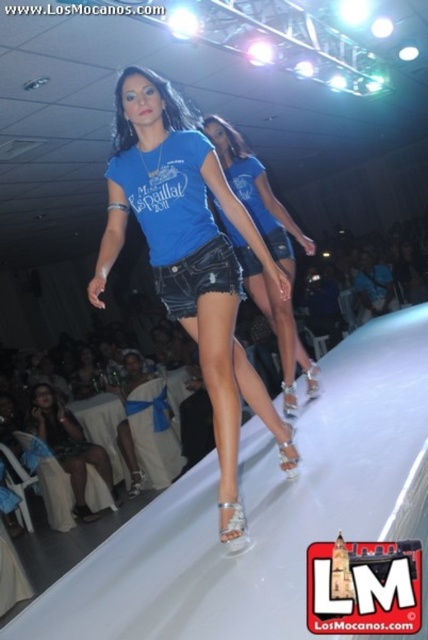
Question: Is blue denim shorts at center above denim shorts at center?

Choices:
 (A) no
 (B) yes

Answer: (B)

Question: Does matte blue denim shorts at center have a lesser width compared to denim shorts at center?

Choices:
 (A) yes
 (B) no

Answer: (B)

Question: Which object is closer to the camera taking this photo?

Choices:
 (A) matte black dress at lower left
 (B) denim shorts at center
 (C) blue denim shorts at center
 (D) matte blue denim shorts at center

Answer: (D)

Question: Which object is positioned closest to the blue denim shorts at center?

Choices:
 (A) matte black dress at lower left
 (B) denim shorts at center
 (C) matte blue denim shorts at center

Answer: (C)

Question: Which object appears closest to the camera in this image?

Choices:
 (A) denim shorts at center
 (B) matte black dress at lower left
 (C) blue denim shorts at center
 (D) matte blue denim shorts at center

Answer: (D)

Question: In this image, where is matte blue denim shorts at center located relative to matte black dress at lower left?

Choices:
 (A) right
 (B) left

Answer: (A)